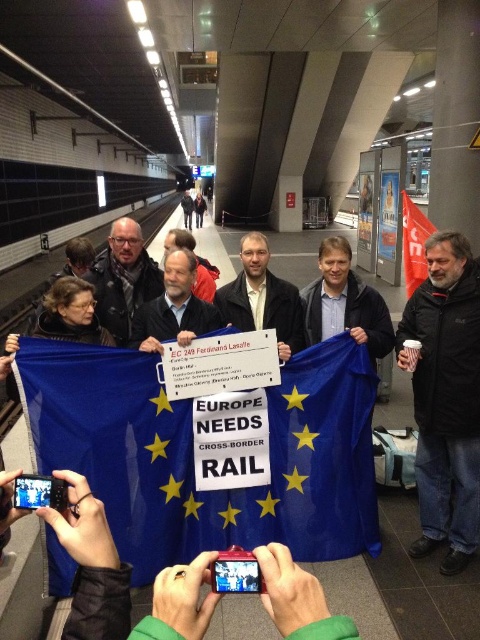
Question: Considering the real-world distances, which object is closest to the beige fabric shirt at center?

Choices:
 (A) blue fabric flag at center
 (B) matte black sign at center
 (C) dark gray jacket at center
 (D) red fabric flag at right

Answer: (B)

Question: Is matte black sign at center further to camera compared to red fabric flag at right?

Choices:
 (A) yes
 (B) no

Answer: (B)

Question: Among these objects, which one is nearest to the camera?

Choices:
 (A) dark gray jacket at center
 (B) matte black sign at center
 (C) blue fabric flag at center
 (D) beige fabric shirt at center

Answer: (C)

Question: Is black jacket at right closer to camera compared to dark gray jacket at center?

Choices:
 (A) yes
 (B) no

Answer: (A)

Question: Does blue fabric flag at center have a larger size compared to beige fabric shirt at center?

Choices:
 (A) yes
 (B) no

Answer: (A)

Question: Based on their relative distances, which object is nearer to the blue fabric flag at center?

Choices:
 (A) dark gray jacket at center
 (B) red fabric flag at right
 (C) beige fabric shirt at center
 (D) black jacket at right

Answer: (C)